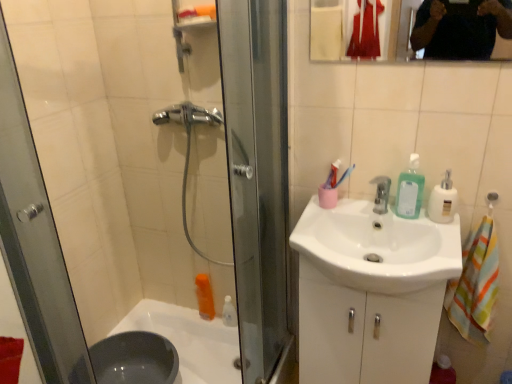
The image size is (512, 384). Identify the location of free point to the left of silver metallic faucet at center. (339, 216).